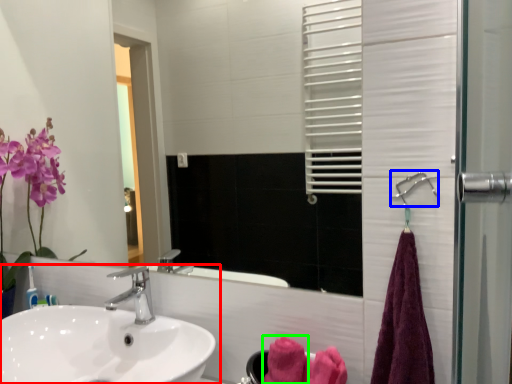
Question: Which object is positioned farthest from sink (highlighted by a red box)? Select from shower (highlighted by a blue box) and bath towel (highlighted by a green box).

Choices:
 (A) shower
 (B) bath towel

Answer: (A)